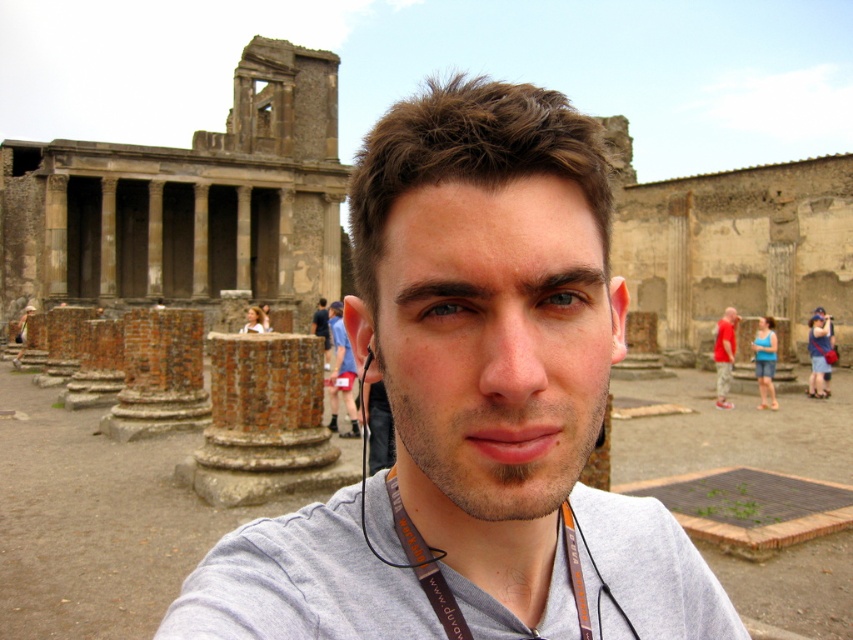
You are a photographer trying to focus on the gray fabric shirt at center in the image. Where exactly should you adjust the focus to capture the shirt clearly?

You should focus at point (473, 406) to capture the gray fabric shirt at center clearly.

You are a fashion designer observing the scene. You need to determine which clothing item has a narrower width between the blue fabric shorts at center and the red cotton shirt at right. Which one is it?

The blue fabric shorts at center has a narrower width than the red cotton shirt at right according to the description.

You are a photographer trying to capture a candid shot of the scene. You notice the blue fabric shorts at center and the red cotton shirt at right. Which object should you focus on to ensure the other remains in the background?

You should focus on the blue fabric shorts at center because it is in front of the red cotton shirt at right, so keeping the shorts in focus will naturally place the red cotton shirt at right in the background.